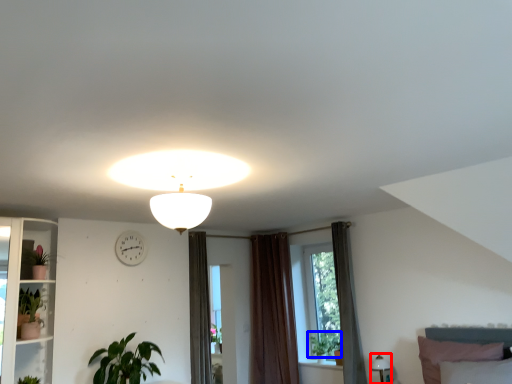
Question: Which object is further to the camera taking this photo, lamp (highlighted by a red box) or plant (highlighted by a blue box)?

Choices:
 (A) lamp
 (B) plant

Answer: (B)